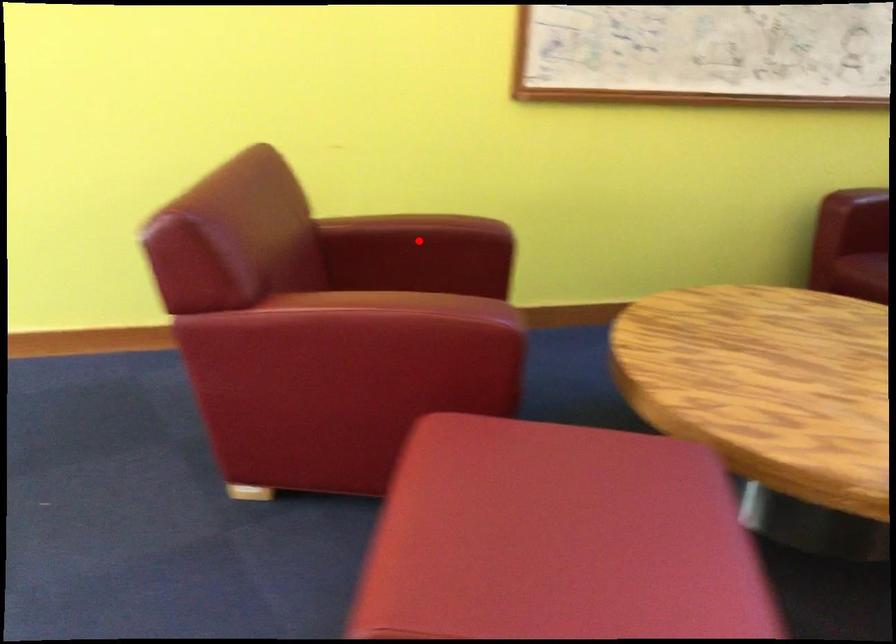
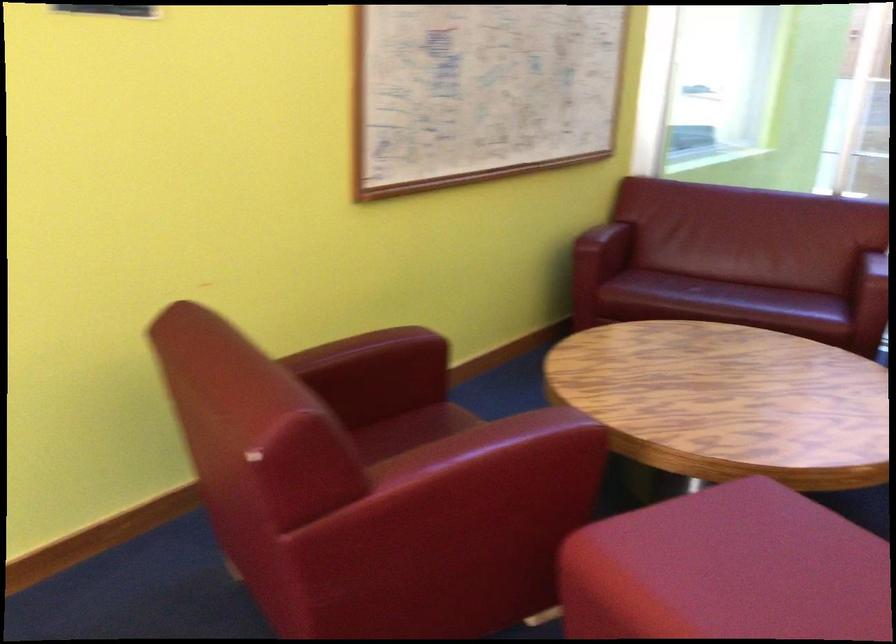
In the second image, find the point that corresponds to the highlighted location in the first image.

(375, 363)